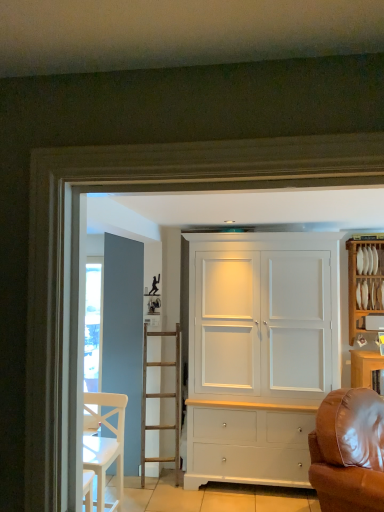
Question: Is white wooden chair at lower left bigger or smaller than brown leather couch at right?

Choices:
 (A) small
 (B) big

Answer: (A)

Question: From the image's perspective, relative to brown leather couch at right, is white wooden chair at lower left above or below?

Choices:
 (A) below
 (B) above

Answer: (B)

Question: Which object is positioned closest to the white wooden chair at lower left?

Choices:
 (A) white wood cabinet at right
 (B) brown leather couch at right
 (C) white matte cabinet at center

Answer: (C)

Question: Which is farther from the white matte cabinet at center?

Choices:
 (A) brown leather couch at right
 (B) white wood cabinet at right
 (C) white wooden chair at lower left

Answer: (C)